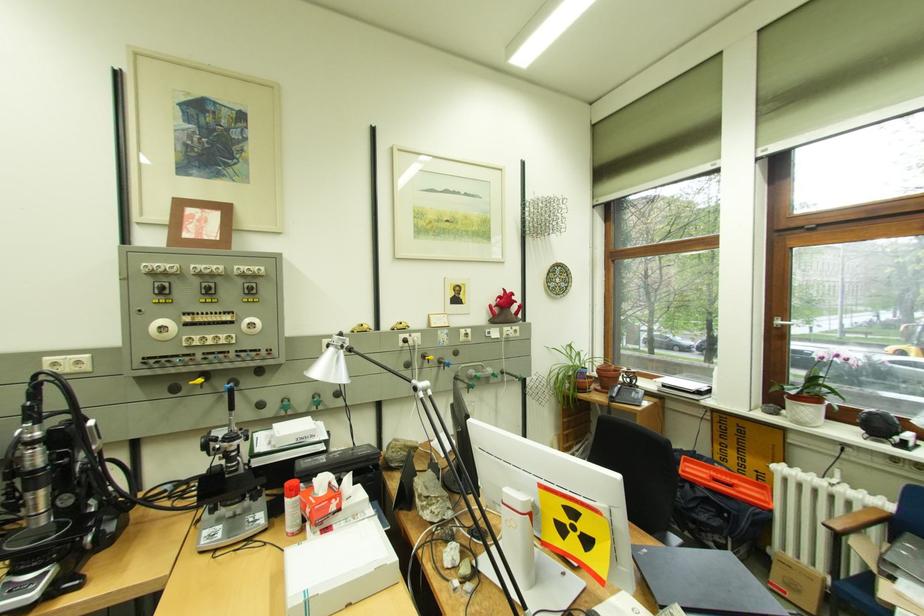
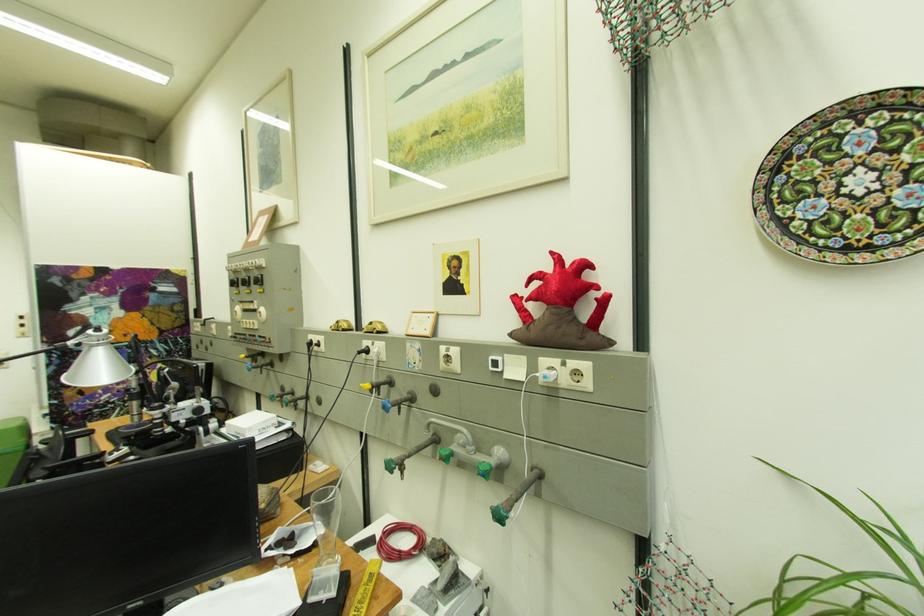
Where in the second image is the point corresponding to the point at 334,341 from the first image?

(320, 336)